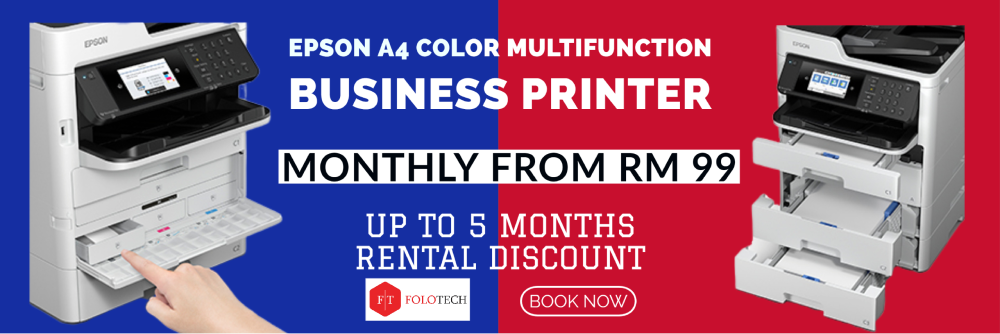
Locate an element on the screen. The width and height of the screenshot is (1000, 334). bottom paper try in printer is located at coordinates (812, 265).